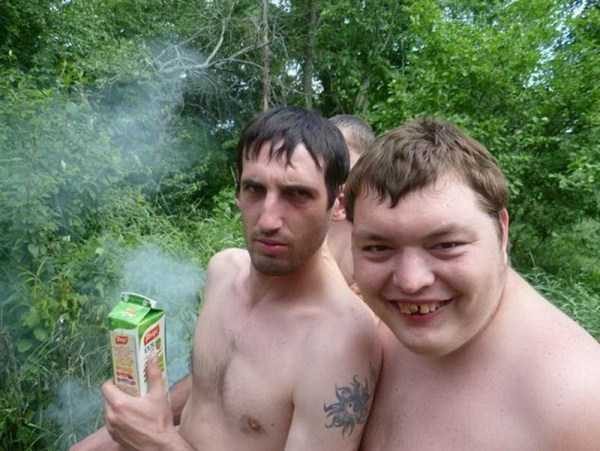
The width and height of the screenshot is (600, 451). What are the coordinates of `juice carton` in the screenshot? It's located at (138, 334).